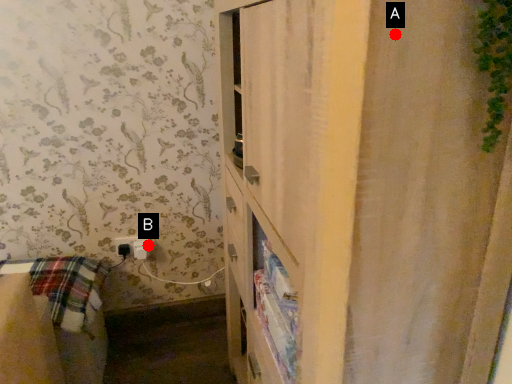
Question: Two points are circled on the image, labeled by A and B beside each circle. Which point is closer to the camera taking this photo?

Choices:
 (A) A is closer
 (B) B is closer

Answer: (A)